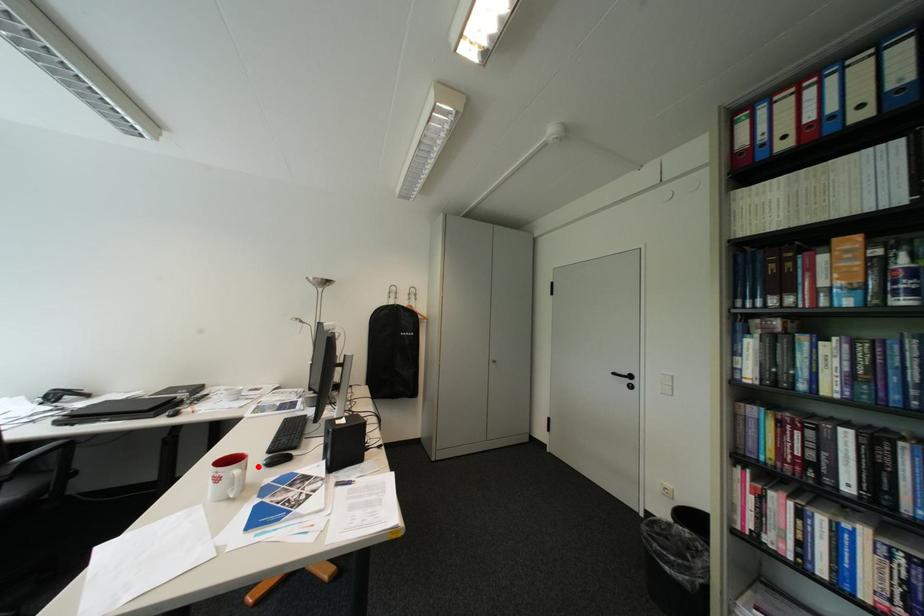
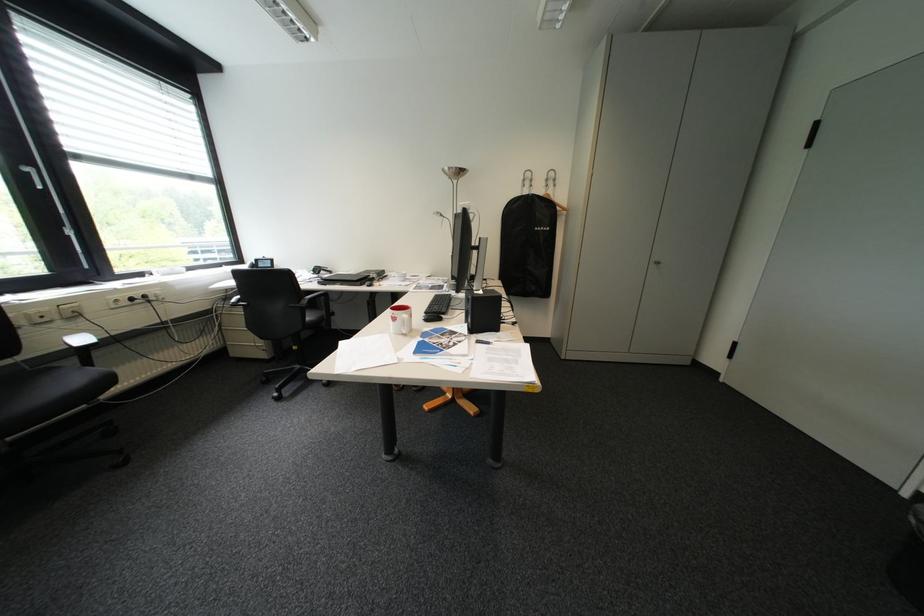
The point at the highlighted location is marked in the first image. Where is the corresponding point in the second image?

(423, 315)